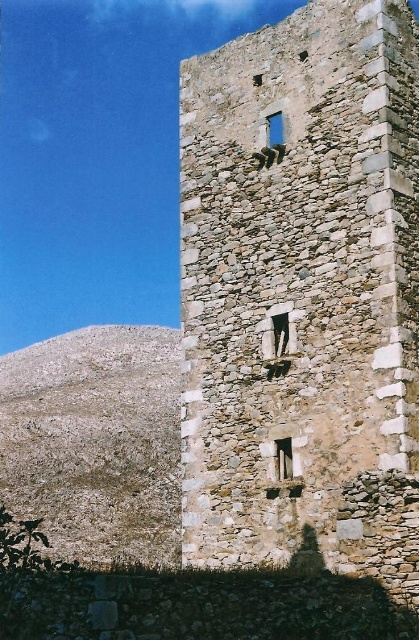
You are a drone operator tasked with capturing aerial footage of the rustic stone tower at center and the brown rocky hill at lower left. Your drone has a maximum flight range of 25 meters. Can the drone safely capture footage of both locations without exceeding its range?

The rustic stone tower at center and the brown rocky hill at lower left are 25.28 meters apart from each other. Since the distance between them is slightly over the drone maximum flight range of 25 meters, the drone cannot safely capture footage of both locations without exceeding its range.

You are an architect examining the stone tower and notice two windows at the center. Which window, the smooth stone window at center or the blue glass window at center, has a bigger size?

The smooth stone window at center has a larger size compared to the blue glass window at center.

You are a maintenance worker tasked with repairing the windows of the stone tower. You have a ladder that can reach up to 8 meters. If you need to move from the smooth stone window at center to the blue glass window at center, will your ladder be sufficient to reach both windows without needing to adjust its height?

The smooth stone window at center and blue glass window at center are 8.30 meters apart from each other. Since the ladder can only reach up to 8 meters, it will not be sufficient to reach both windows without adjusting its height.